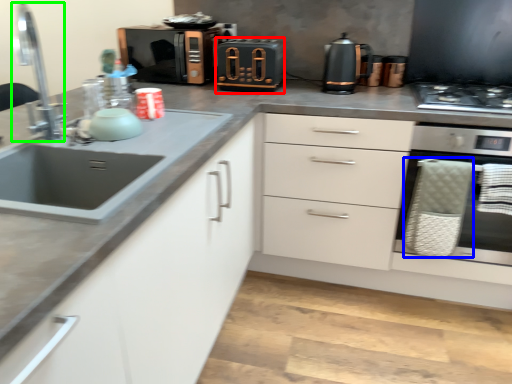
Question: Estimate the real-world distances between objects in this image. Which object is closer to appliance (highlighted by a red box), basket (highlighted by a blue box) or faucet (highlighted by a green box)?

Choices:
 (A) basket
 (B) faucet

Answer: (A)